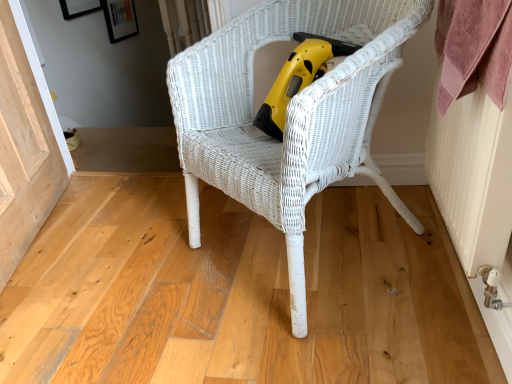
Question: Is natural wood screen door at lower left closer to the viewer compared to white wicker chair at center?

Choices:
 (A) yes
 (B) no

Answer: (B)

Question: Is natural wood screen door at lower left outside of white wicker chair at center?

Choices:
 (A) yes
 (B) no

Answer: (A)

Question: Are natural wood screen door at lower left and white wicker chair at center located far from each other?

Choices:
 (A) yes
 (B) no

Answer: (B)

Question: Is natural wood screen door at lower left taller than white wicker chair at center?

Choices:
 (A) no
 (B) yes

Answer: (A)

Question: Is white wicker chair at center completely or partially inside natural wood screen door at lower left?

Choices:
 (A) yes
 (B) no

Answer: (B)

Question: Would you say natural wood screen door at lower left is inside or outside yellow plastic vacuum at center?

Choices:
 (A) outside
 (B) inside

Answer: (A)

Question: Is natural wood screen door at lower left in front of or behind yellow plastic vacuum at center in the image?

Choices:
 (A) behind
 (B) front

Answer: (B)

Question: Does point (32, 102) appear closer or farther from the camera than point (312, 54)?

Choices:
 (A) farther
 (B) closer

Answer: (A)

Question: Is natural wood screen door at lower left to the left or to the right of yellow plastic vacuum at center in the image?

Choices:
 (A) left
 (B) right

Answer: (A)

Question: From the image's perspective, is white wicker chair at center positioned above or below yellow plastic vacuum at center?

Choices:
 (A) below
 (B) above

Answer: (A)

Question: Is point (275, 36) positioned closer to the camera than point (292, 84)?

Choices:
 (A) farther
 (B) closer

Answer: (A)

Question: Is white wicker chair at center inside or outside of yellow plastic vacuum at center?

Choices:
 (A) outside
 (B) inside

Answer: (A)

Question: From a real-world perspective, is white wicker chair at center positioned above or below yellow plastic vacuum at center?

Choices:
 (A) above
 (B) below

Answer: (B)

Question: From a real-world perspective, relative to natural wood screen door at lower left, is white wicker chair at center vertically above or below?

Choices:
 (A) above
 (B) below

Answer: (A)

Question: Considering the positions of white wicker chair at center and natural wood screen door at lower left in the image, is white wicker chair at center bigger or smaller than natural wood screen door at lower left?

Choices:
 (A) small
 (B) big

Answer: (B)